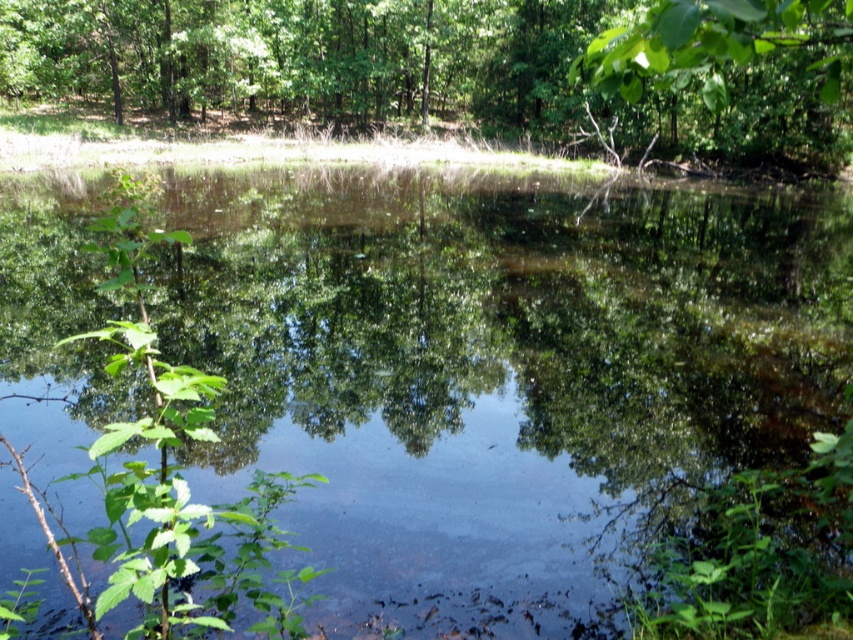
Can you confirm if transparent water at center is positioned to the left of green leafy tree at upper right?

Indeed, transparent water at center is positioned on the left side of green leafy tree at upper right.

Consider the image. Which is more to the left, transparent water at center or green leafy tree at upper right?

transparent water at center is more to the left.

Between point (405, 246) and point (744, 24), which one is positioned in front?

Point (744, 24)

Locate an element on the screen. This screenshot has height=640, width=853. transparent water at center is located at coordinates (498, 369).

Who is shorter, transparent water at center or green leafy tree at upper center?

transparent water at center is shorter.

Is point (845, 224) positioned in front of point (479, 106)?

That is True.

At what (x,y) coordinates should I click in order to perform the action: click on transparent water at center. Please return your answer as a coordinate pair (x, y). Looking at the image, I should click on (498, 369).

At what (x,y) coordinates should I click in order to perform the action: click on transparent water at center. Please return your answer as a coordinate pair (x, y). Image resolution: width=853 pixels, height=640 pixels. Looking at the image, I should click on (498, 369).

Measure the distance between point (202, 81) and camera.

Point (202, 81) is 40.77 meters away from camera.

Can you confirm if green leafy tree at upper center is positioned below green leafy tree at upper right?

No.

Does point (273, 36) come farther from viewer compared to point (674, 45)?

Yes, point (273, 36) is behind point (674, 45).

This screenshot has width=853, height=640. Find the location of `green leafy tree at upper center`. green leafy tree at upper center is located at coordinates (387, 68).